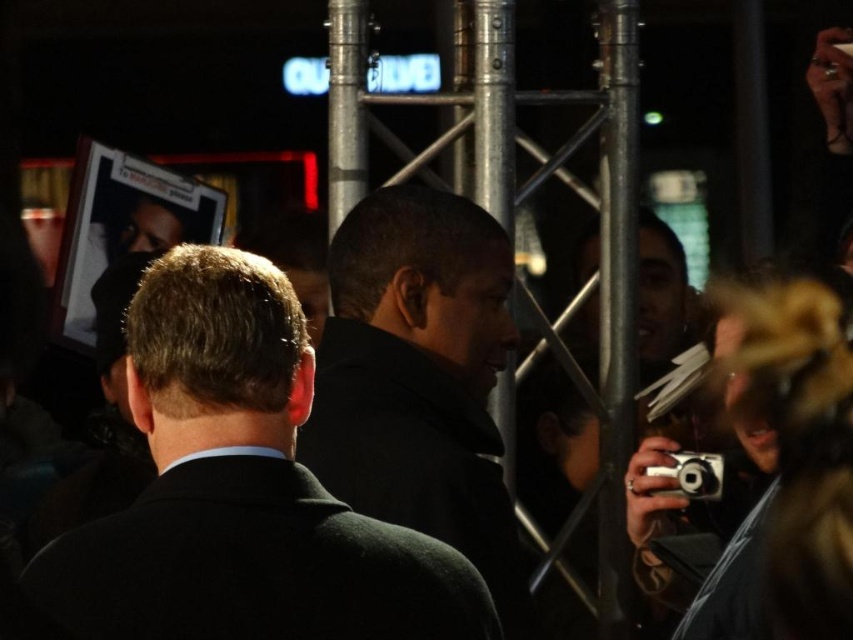
Does dark gray wool coat at center have a smaller size compared to silver metallic camera at lower right?

Incorrect, dark gray wool coat at center is not smaller in size than silver metallic camera at lower right.

Who is lower down, dark gray wool coat at center or silver metallic camera at lower right?

silver metallic camera at lower right is below.

The height and width of the screenshot is (640, 853). What do you see at coordinates (419, 378) in the screenshot? I see `dark gray wool coat at center` at bounding box center [419, 378].

What are the coordinates of `dark gray wool coat at center` in the screenshot? It's located at (419, 378).

Describe the element at coordinates (241, 490) in the screenshot. The width and height of the screenshot is (853, 640). I see `black wool coat at center` at that location.

Does black wool coat at center have a lesser height compared to black woolen suit at center?

No.

The image size is (853, 640). What do you see at coordinates (241, 490) in the screenshot?
I see `black wool coat at center` at bounding box center [241, 490].

Where is `black wool coat at center`? black wool coat at center is located at coordinates (241, 490).

Does dark gray wool coat at center appear over black woolen suit at center?

Yes.

The width and height of the screenshot is (853, 640). I want to click on dark gray wool coat at center, so click(419, 378).

At what (x,y) coordinates should I click in order to perform the action: click on dark gray wool coat at center. Please return your answer as a coordinate pair (x, y). The image size is (853, 640). Looking at the image, I should click on tap(419, 378).